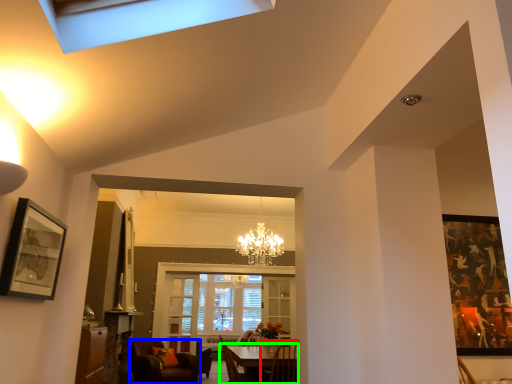
Question: Which object is the closest to the chair (highlighted by a red box)? Choose among these: chair (highlighted by a blue box) or table (highlighted by a green box).

Choices:
 (A) chair
 (B) table

Answer: (B)